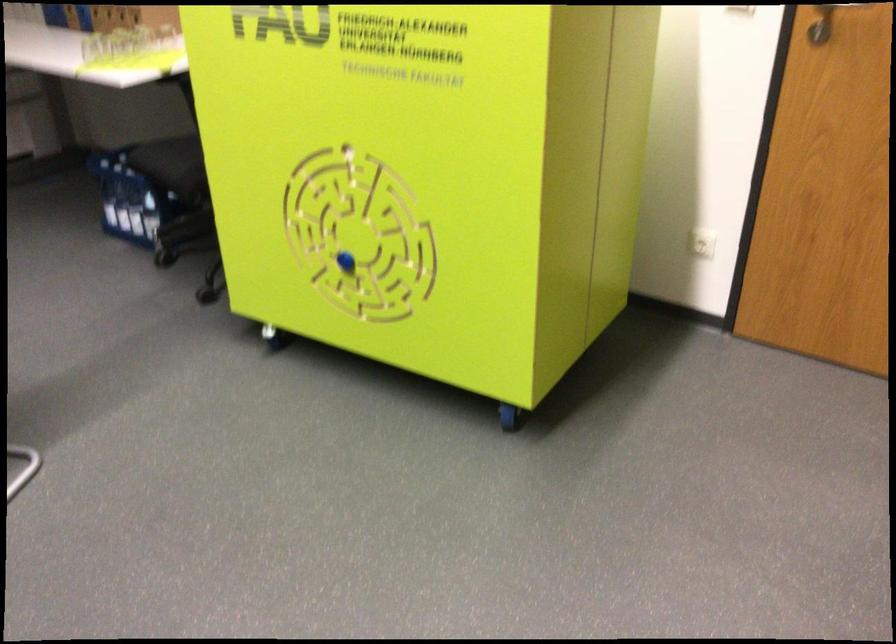
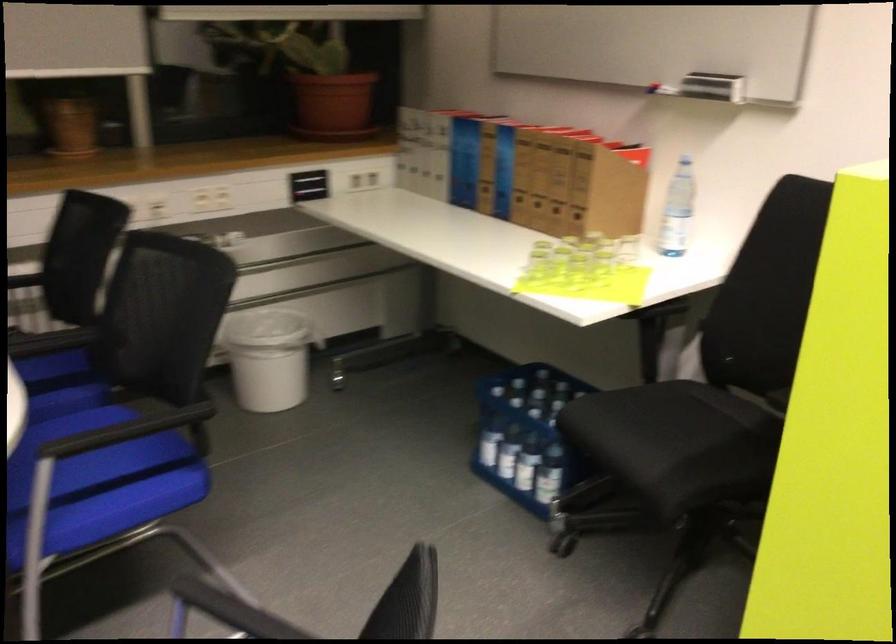
The images are taken continuously from a first-person perspective. In which direction are you moving?

The cameraman moved toward left, forward.